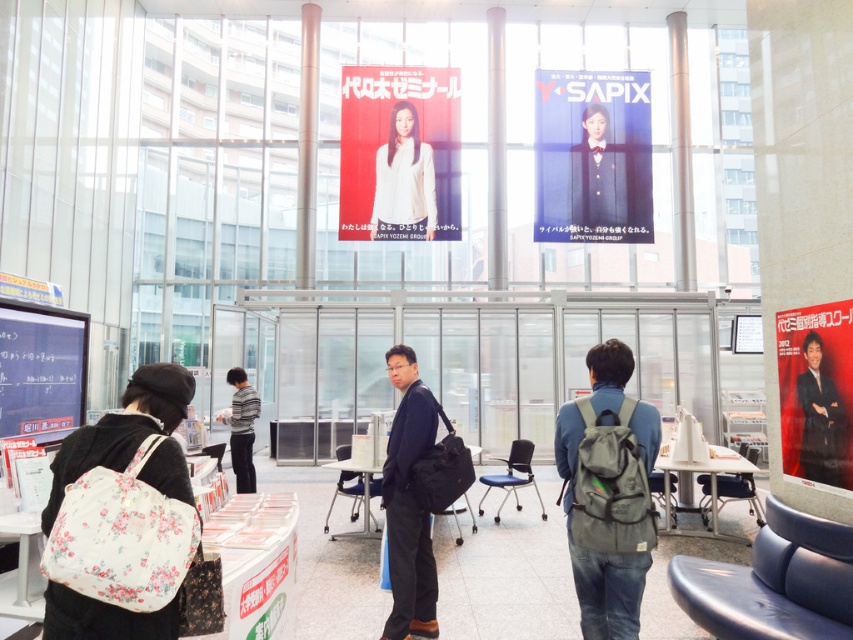
Can you confirm if dark blue suit at center is positioned above dark blue uniform at upper center?

No.

Can you confirm if dark blue suit at center is positioned to the left of dark blue uniform at upper center?

Indeed, dark blue suit at center is positioned on the left side of dark blue uniform at upper center.

Is point (387, 516) behind point (618, 214)?

No, (387, 516) is closer to viewer.

Find the location of a particular element. Image resolution: width=853 pixels, height=640 pixels. dark blue suit at center is located at coordinates (408, 502).

Between white matte poster at upper center and floral fabric bag at lower left, which one appears on the right side from the viewer's perspective?

white matte poster at upper center is more to the right.

Is white matte poster at upper center below floral fabric bag at lower left?

Actually, white matte poster at upper center is above floral fabric bag at lower left.

Who is more forward, (x=345, y=131) or (x=171, y=364)?

Point (x=171, y=364)

Locate an element on the screen. Image resolution: width=853 pixels, height=640 pixels. white matte poster at upper center is located at coordinates (399, 154).

Consider the image. Can you confirm if dark blue suit at center is taller than matte black screen at left?

Correct, dark blue suit at center is much taller as matte black screen at left.

Can you confirm if dark blue suit at center is smaller than matte black screen at left?

No.

Where is `dark blue suit at center`? The height and width of the screenshot is (640, 853). dark blue suit at center is located at coordinates (408, 502).